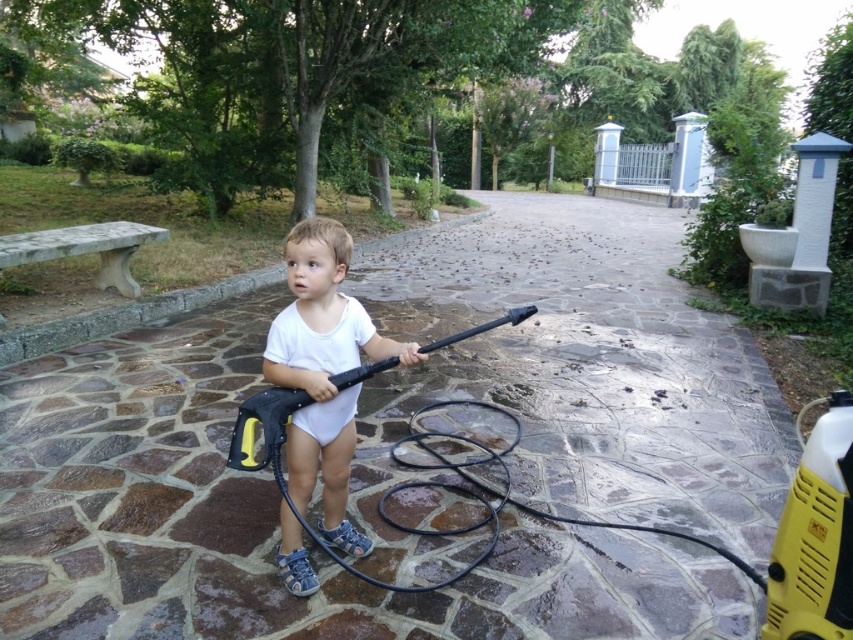
Question: Which object is farther from the camera taking this photo?

Choices:
 (A) brown stone pavement at center
 (B) white matte onesie at center

Answer: (A)

Question: Which point appears closest to the camera in this image?

Choices:
 (A) (345, 484)
 (B) (184, 332)

Answer: (A)

Question: Does brown stone pavement at center appear over white matte onesie at center?

Choices:
 (A) no
 (B) yes

Answer: (B)

Question: Is brown stone pavement at center closer to camera compared to white matte onesie at center?

Choices:
 (A) no
 (B) yes

Answer: (A)

Question: Which object appears closest to the camera in this image?

Choices:
 (A) white matte onesie at center
 (B) brown stone pavement at center

Answer: (A)

Question: Can you confirm if brown stone pavement at center is positioned below white matte onesie at center?

Choices:
 (A) no
 (B) yes

Answer: (A)